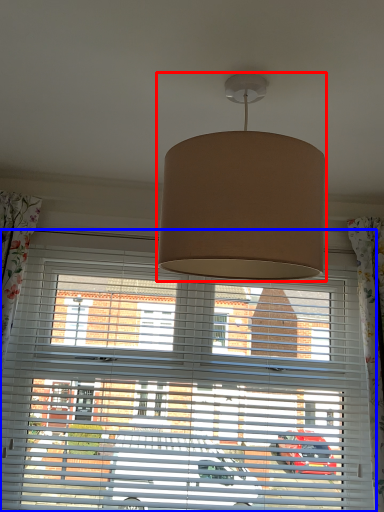
Question: Among these objects, which one is nearest to the camera, lamp (highlighted by a red box) or window blind (highlighted by a blue box)?

Choices:
 (A) lamp
 (B) window blind

Answer: (A)